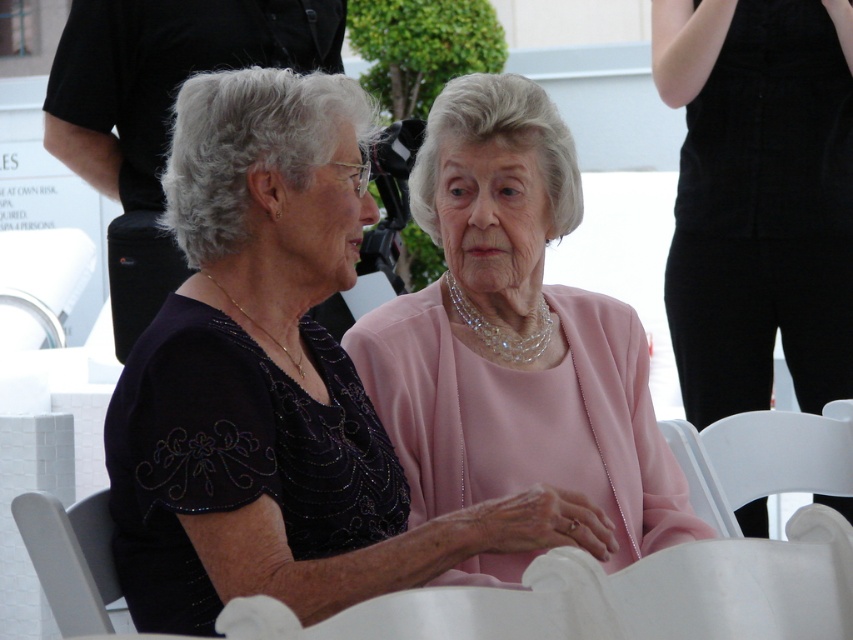
Measure the distance from matte black dress at center to white plastic chair at lower left.

A distance of 10.62 inches exists between matte black dress at center and white plastic chair at lower left.

Describe the element at coordinates (274, 384) in the screenshot. This screenshot has width=853, height=640. I see `matte black dress at center` at that location.

The width and height of the screenshot is (853, 640). In order to click on matte black dress at center in this screenshot , I will do `click(274, 384)`.

Looking at this image, between matte black dress at center and black satin dress at center, which one is positioned lower?

Positioned lower is matte black dress at center.

Which is in front, point (375, 477) or point (698, 304)?

Point (375, 477)

Image resolution: width=853 pixels, height=640 pixels. In order to click on matte black dress at center in this screenshot , I will do `click(274, 384)`.

The width and height of the screenshot is (853, 640). Find the location of `matte black dress at center`. matte black dress at center is located at coordinates (274, 384).

Can you confirm if matte black dress at center is positioned to the right of white plastic chair at lower right?

Incorrect, matte black dress at center is not on the right side of white plastic chair at lower right.

Is matte black dress at center taller than white plastic chair at lower right?

Correct, matte black dress at center is much taller as white plastic chair at lower right.

Is point (428, 520) in front of point (740, 433)?

That is True.

You are a GUI agent. You are given a task and a screenshot of the screen. Output one action in this format:
    pyautogui.click(x=<x>, y=<y>)
    Task: Click on the matte black dress at center
    This screenshot has width=853, height=640.
    Given the screenshot: What is the action you would take?
    pyautogui.click(x=274, y=384)